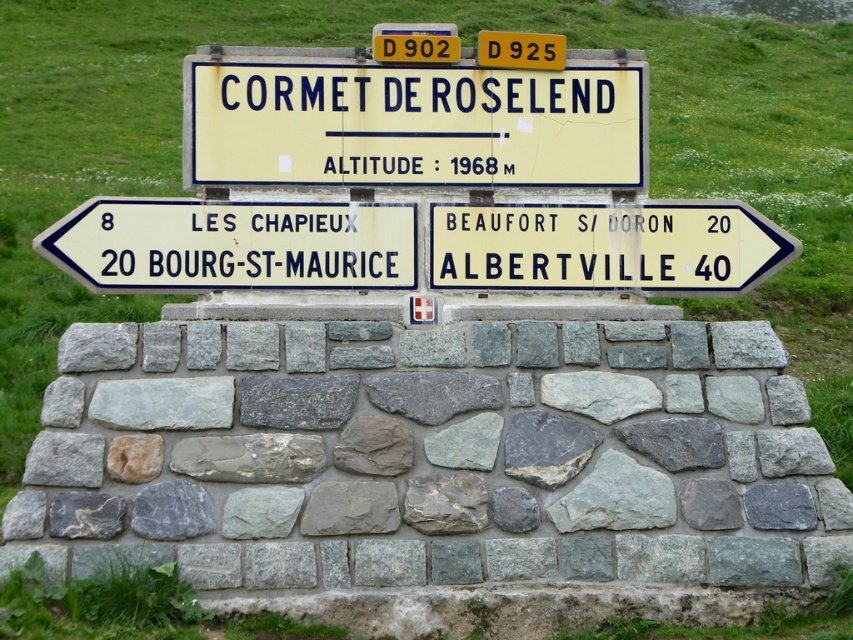
Based on the photo, you are a hiker who needs to check the altitude displayed on the yellow plastic sign at center and the white plastic sign at right. Which sign should you look at to find the altitude information?

The yellow plastic sign at center displays the altitude information, as it is the one with the text stating ALTITUDE 1968 M, while the white plastic sign at right does not mention altitude.

You are standing in front of the signpost and want to take a photo. Which point, point (x=370, y=141) or point (x=154, y=220), will appear closer to the camera in the photo?

Point (x=154, y=220) will appear closer to the camera in the photo because it is in front of point (x=370, y=141).